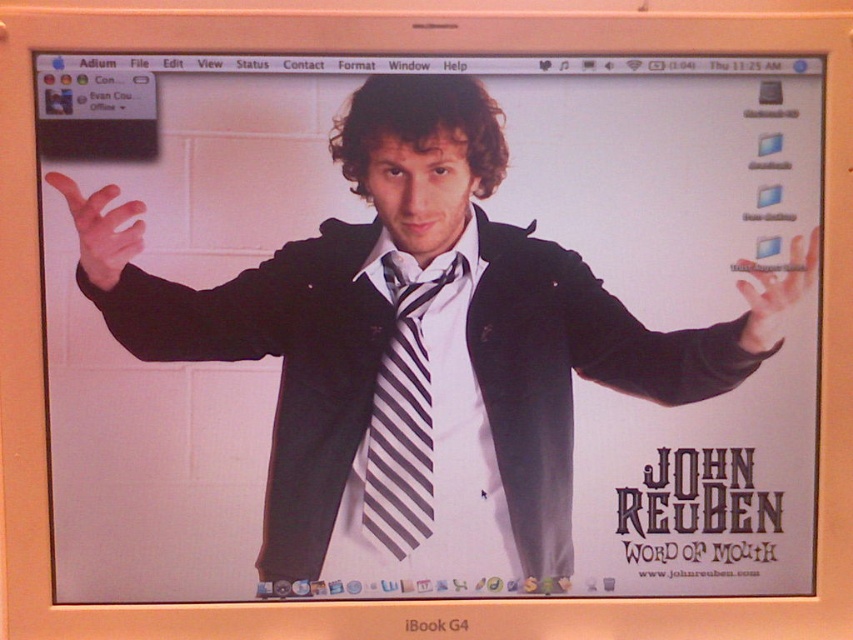
You are a graphic designer reviewing a desktop background for a client. You need to ensure that the black striped tie at center and the matte black hand at left are positioned correctly. Based on the image, which object is taller?

The black striped tie at center is taller than the matte black hand at left.

You are a graphic designer working on a desktop background. You need to ensure that the black striped tie at center and the matte black hand at right are positioned correctly. According to the design guidelines, the hand should always be above the tie. Is the current arrangement following the guidelines?

The black striped tie at center is located below the matte black hand at right, so the current arrangement follows the design guidelines because the hand is above the tie.

You are designing a digital frame that needs to display both the black striped tie at center and the matte black hand at right. The frame has a width limit of 10 cm. Given their widths, can both objects fit side by side within the frame without overlapping?

The black striped tie at center is wider than the matte black hand at right. Since the frame has a 10 cm width limit, and the tie alone is already wider than the hand, it is uncertain if both can fit without overlapping without knowing their exact widths. However, since the tie is wider, it might exceed the frame when combined with the hand.